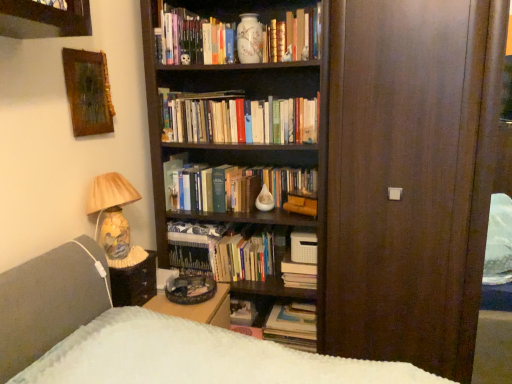
Locate an element on the screen. The width and height of the screenshot is (512, 384). empty space that is ontop of hardcover books at center, acting as the 3th book starting from the top is located at coordinates (244, 98).